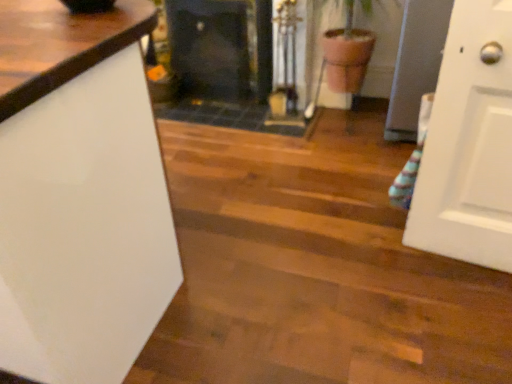
Question: Is black glass fireplace at center, the second fireplace viewed from the left, wider or thinner than white glossy countertop at left?

Choices:
 (A) thin
 (B) wide

Answer: (A)

Question: In terms of height, does black glass fireplace at center, the 1th fireplace from the right, look taller or shorter compared to white glossy countertop at left?

Choices:
 (A) tall
 (B) short

Answer: (B)

Question: Estimate the real-world distances between objects in this image. Which object is closer to the black glass fireplace at center, the 1th fireplace from the right?

Choices:
 (A) black glass fireplace at center, which ranks as the first fireplace in left-to-right order
 (B) white glossy countertop at left

Answer: (A)

Question: Which object is the farthest from the white glossy countertop at left?

Choices:
 (A) black glass fireplace at center, arranged as the 2th fireplace when viewed from the right
 (B) black glass fireplace at center, the second fireplace viewed from the left

Answer: (A)